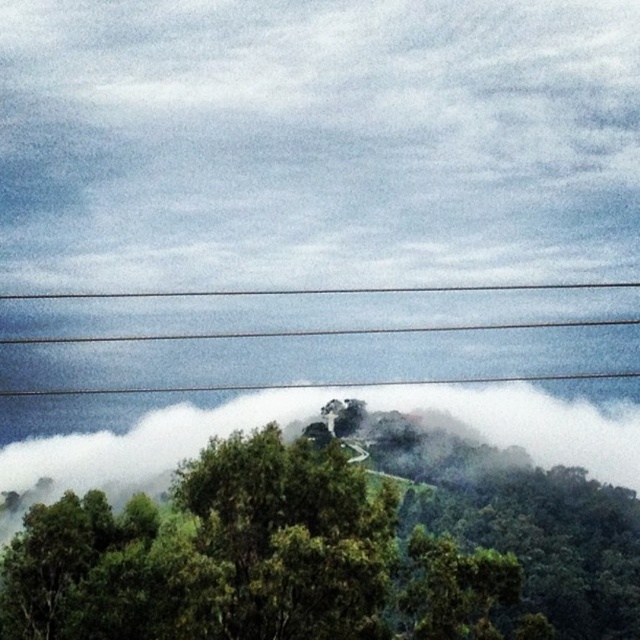
You are a hiker planning to walk from the green leafy tree at center to the smooth wire at upper center. The path is narrow and has a width of 6 meters. Can you safely walk through the path without any obstacles?

The distance between the green leafy tree at center and the smooth wire at upper center is 7.27 meters. Since the path is 6 meters wide, you can safely walk through the path as the width is sufficient for passage.

You are standing at the bottom of the hill and see the green leafy tree at center. If you want to walk directly towards the tree, which direction should you move relative to the current position?

Since the green leafy tree at center is located at point 0.859 on the x axis and 0.516 on the y axis, you should move towards the center of the image to reach it.

In the scene shown: You are a hiker standing at the base of the hill and see the green leafy tree at center and the smooth wire at upper center. Which object is higher up the hill?

The smooth wire at upper center is higher up the hill than the green leafy tree at center because the green leafy tree at center is located below it.